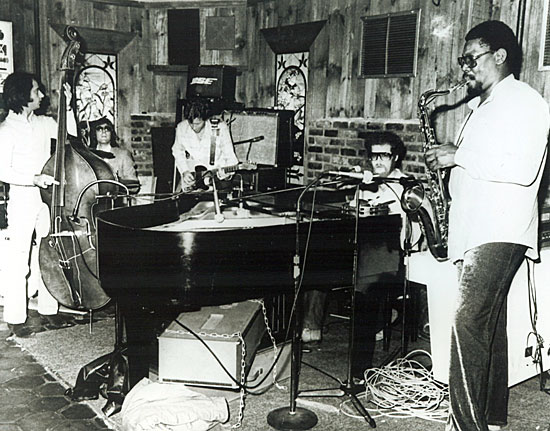
In order to click on stained glass in this screenshot , I will do `click(91, 92)`, `click(292, 79)`.